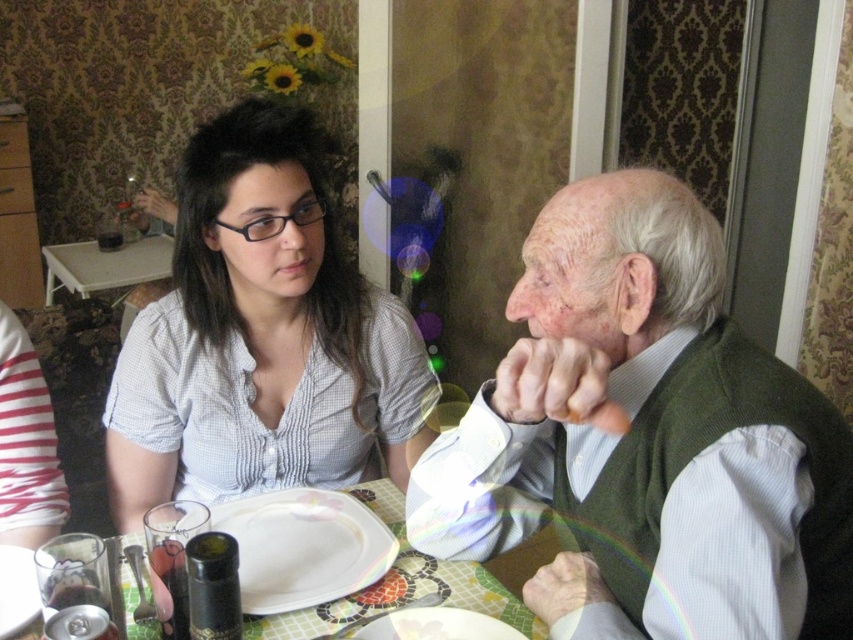
What do you see at coordinates (303, 547) in the screenshot? This screenshot has height=640, width=853. I see `white glossy platter at center` at bounding box center [303, 547].

Who is taller, white glossy platter at center or white glossy plate at lower center?

With more height is white glossy platter at center.

Which is in front, point (250, 516) or point (376, 636)?

Point (376, 636) is in front.

Identify the location of white glossy platter at center. (303, 547).

Can you confirm if green textured vest at right is smaller than white glossy platter at center?

No.

Is green textured vest at right behind white glossy platter at center?

No, green textured vest at right is in front of white glossy platter at center.

This screenshot has width=853, height=640. Find the location of `green textured vest at right`. green textured vest at right is located at coordinates coord(645,440).

Describe the element at coordinates (303, 547) in the screenshot. Image resolution: width=853 pixels, height=640 pixels. I see `white glossy platter at center` at that location.

Does white glossy platter at center appear on the left side of white plastic table at upper left?

Incorrect, white glossy platter at center is not on the left side of white plastic table at upper left.

Is point (374, 541) positioned after point (90, 275)?

No, (374, 541) is closer to viewer.

Locate an element on the screen. Image resolution: width=853 pixels, height=640 pixels. white glossy platter at center is located at coordinates (303, 547).